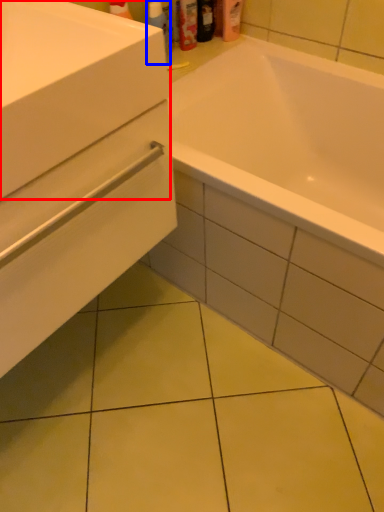
Question: Which object is closer to the camera taking this photo, sink (highlighted by a red box) or cleaning product (highlighted by a blue box)?

Choices:
 (A) sink
 (B) cleaning product

Answer: (A)